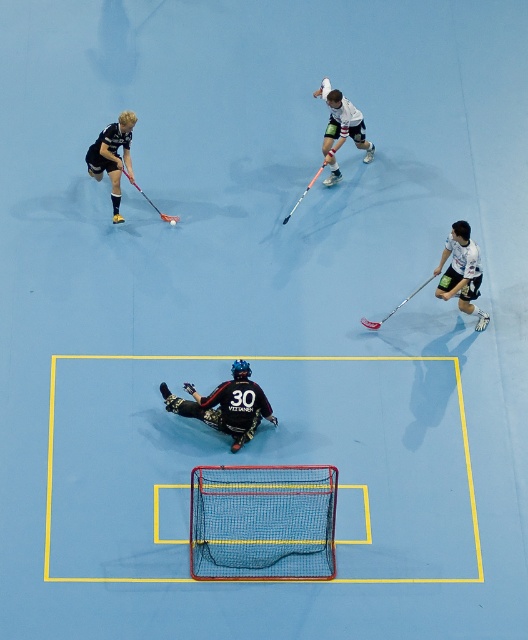
You are a player in the game and you want to retrieve your black matte hockey stick at upper left. You are currently standing near the netting fabric at center. Which direction should you move to reach your hockey stick?

The netting fabric at center is closer to the viewer than the black matte hockey stick at upper left, so you should move backward to reach the black matte hockey stick at upper left.

Based on the photo, you are a referee observing an indoor floorball match. You need to determine which hockey stick is larger between the white matte hockey stick at right and the black matte hockey stick at upper left. Based on the scene, which one is bigger?

The white matte hockey stick at right is bigger than the black matte hockey stick at upper left.